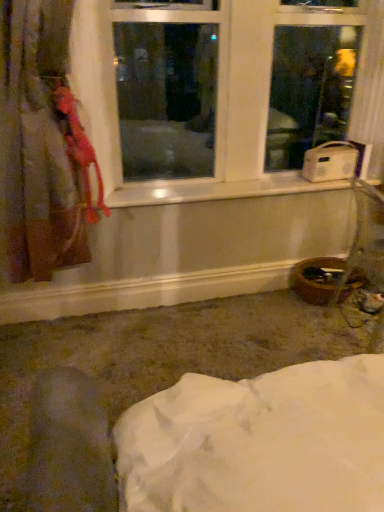
At what (x,y) coordinates should I click in order to perform the action: click on white plastic radio at right. Please return your answer as a coordinate pair (x, y). Image resolution: width=384 pixels, height=512 pixels. Looking at the image, I should click on (330, 162).

In order to face velvet-like pink curtain at left, should I rotate leftwards or rightwards?

It's best to rotate left around 16.013 degrees.

This screenshot has height=512, width=384. Describe the element at coordinates (215, 190) in the screenshot. I see `white plastic window sill at center` at that location.

Locate an element on the screen. The image size is (384, 512). white plastic radio at right is located at coordinates (330, 162).

Does white plastic window at upper center come behind velvet-like pink curtain at left?

That is True.

Between white plastic window at upper center and velvet-like pink curtain at left, which one has more height?

With more height is velvet-like pink curtain at left.

Considering the relative sizes of white plastic window at upper center and velvet-like pink curtain at left in the image provided, is white plastic window at upper center wider than velvet-like pink curtain at left?

Incorrect, the width of white plastic window at upper center does not surpass that of velvet-like pink curtain at left.

Which is closer, (147, 37) or (259, 191)?

Clearly, point (147, 37) is more distant from the camera than point (259, 191).

Does white plastic window at upper center come behind white plastic window sill at center?

No, it is not.

This screenshot has width=384, height=512. Find the location of `window sill behind the white plastic window at upper center`. window sill behind the white plastic window at upper center is located at coordinates (215, 190).

Which object is wider, white plastic window at upper center or white plastic window sill at center?

With larger width is white plastic window at upper center.

From a real-world perspective, is white plastic window at upper center on white plastic radio at right?

Yes, from a real-world perspective, white plastic window at upper center is over white plastic radio at right

From the picture: Can you tell me how much white plastic window at upper center and white plastic radio at right differ in facing direction?

3.95 degrees separate the facing orientations of white plastic window at upper center and white plastic radio at right.

Is white plastic window at upper center wider than white plastic radio at right?

Indeed, white plastic window at upper center has a greater width compared to white plastic radio at right.

In the image, is white plastic window at upper center on the left side or the right side of white plastic radio at right?

white plastic window at upper center is positioned on white plastic radio at right's left side.

Locate an element on the screen. The height and width of the screenshot is (512, 384). window sill behind the velvet-like pink curtain at left is located at coordinates (215, 190).

From the image's perspective, which one is positioned higher, white plastic window sill at center or velvet-like pink curtain at left?

From the image's view, velvet-like pink curtain at left is above.

Is white plastic window sill at center positioned before velvet-like pink curtain at left?

No, white plastic window sill at center is further to the viewer.

From a real-world perspective, is white plastic window sill at center located beneath velvet-like pink curtain at left?

Yes, from a real-world perspective, white plastic window sill at center is beneath velvet-like pink curtain at left.

From a real-world perspective, between white plastic window sill at center and white plastic radio at right, who is vertically lower?

In real-world perspective, white plastic window sill at center is lower.

Is white plastic window sill at center located outside white plastic radio at right?

Yes, white plastic window sill at center is not within white plastic radio at right.

Which is farther from the camera, (286, 174) or (346, 153)?

The point (286, 174) is farther.

Does white plastic window sill at center have a greater width compared to white plastic radio at right?

Yes.

From a real-world perspective, is white plastic radio at right positioned above or below white plastic window at upper center?

From a real-world perspective, white plastic radio at right is physically below white plastic window at upper center.

Is white plastic radio at right in contact with white plastic window at upper center?

No.

Looking at the image, does white plastic radio at right seem bigger or smaller compared to white plastic window at upper center?

white plastic radio at right is smaller than white plastic window at upper center.

Is white plastic window sill at center not close to white plastic window at upper center?

No, white plastic window sill at center is in close proximity to white plastic window at upper center.

Considering the points (316, 188) and (174, 165), which point is behind, point (316, 188) or point (174, 165)?

Positioned behind is point (174, 165).

From the image's perspective, which is below, white plastic window sill at center or white plastic window at upper center?

white plastic window sill at center, from the image's perspective.

Locate an element on the screen. The width and height of the screenshot is (384, 512). window that is on the right side of velvet-like pink curtain at left is located at coordinates (223, 96).

Find the location of `window above the white plastic window sill at center (from the image's perspective)`. window above the white plastic window sill at center (from the image's perspective) is located at coordinates (223, 96).

Estimate the real-world distances between objects in this image. Which object is further from white plastic window at upper center, velvet-like pink curtain at left or white plastic window sill at center?

velvet-like pink curtain at left is further to white plastic window at upper center.

Looking at the image, which one is located closer to white plastic radio at right, velvet-like pink curtain at left or white plastic window sill at center?

Among the two, white plastic window sill at center is located nearer to white plastic radio at right.

From the image, which object appears to be farther from white plastic radio at right, velvet-like pink curtain at left or white plastic window at upper center?

velvet-like pink curtain at left lies further to white plastic radio at right than the other object.

From the image, which object appears to be nearer to white plastic window at upper center, velvet-like pink curtain at left or white plastic radio at right?

white plastic radio at right lies closer to white plastic window at upper center than the other object.

Looking at the image, which one is located closer to velvet-like pink curtain at left, white plastic window sill at center or white plastic radio at right?

white plastic window sill at center.

Based on their spatial positions, is white plastic radio at right or velvet-like pink curtain at left closer to white plastic window sill at center?

white plastic radio at right lies closer to white plastic window sill at center than the other object.

Considering their positions, is white plastic window at upper center positioned closer to velvet-like pink curtain at left than white plastic window sill at center?

Based on the image, white plastic window at upper center appears to be nearer to velvet-like pink curtain at left.

Considering their positions, is white plastic radio at right positioned closer to white plastic window sill at center than white plastic window at upper center?

white plastic window at upper center lies closer to white plastic window sill at center than the other object.

I want to click on window sill between velvet-like pink curtain at left and white plastic radio at right, so click(x=215, y=190).

At what (x,y) coordinates should I click in order to perform the action: click on window situated between velvet-like pink curtain at left and white plastic radio at right from left to right. Please return your answer as a coordinate pair (x, y). The image size is (384, 512). Looking at the image, I should click on [223, 96].

This screenshot has height=512, width=384. I want to click on window sill between white plastic window at upper center and white plastic radio at right in the front-back direction, so click(x=215, y=190).

You are a GUI agent. You are given a task and a screenshot of the screen. Output one action in this format:
    pyautogui.click(x=<x>, y=<y>)
    Task: Click on the window located between velvet-like pink curtain at left and white plastic window sill at center in the left-right direction
    The height and width of the screenshot is (512, 384).
    Given the screenshot: What is the action you would take?
    pyautogui.click(x=223, y=96)